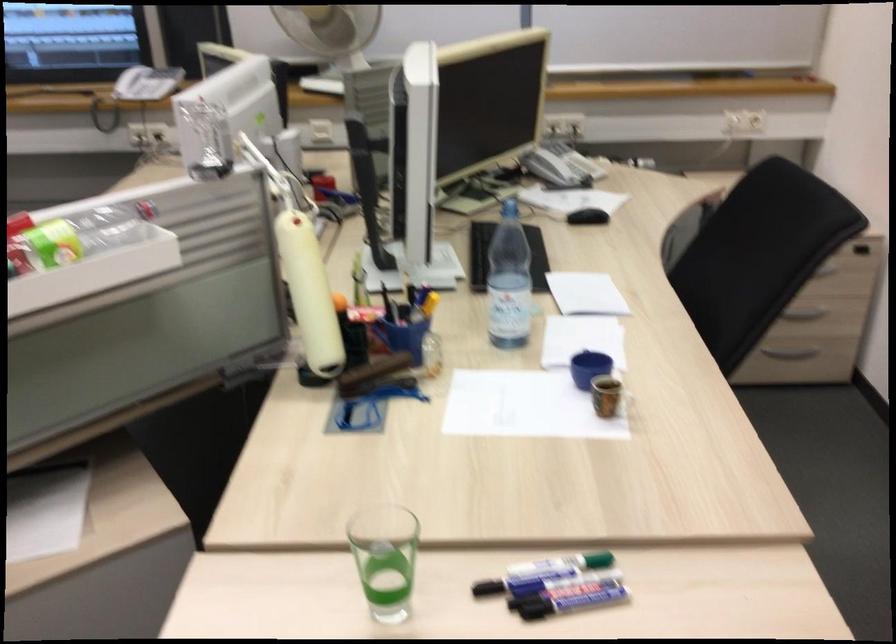
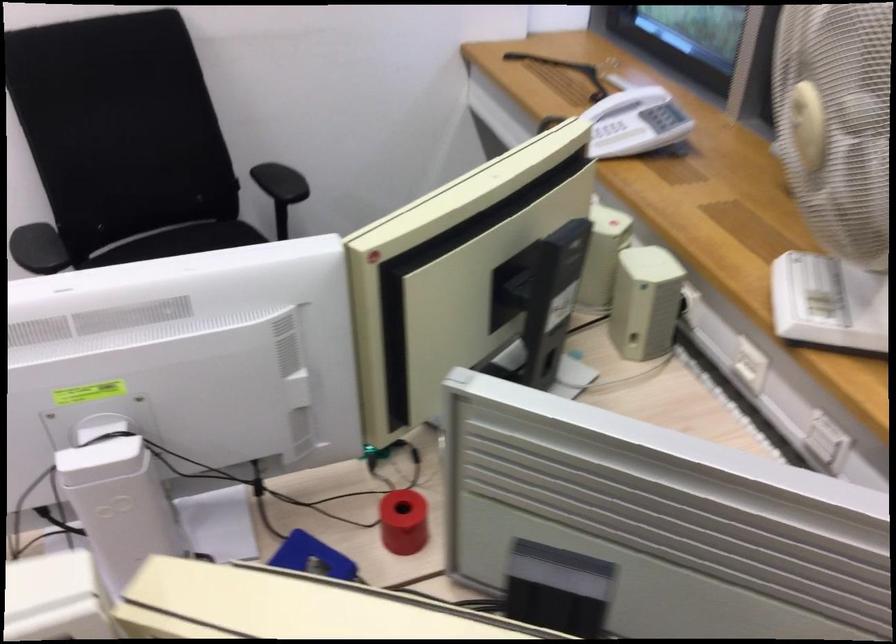
The point at (297, 156) is marked in the first image. Where is the corresponding point in the second image?

(118, 500)